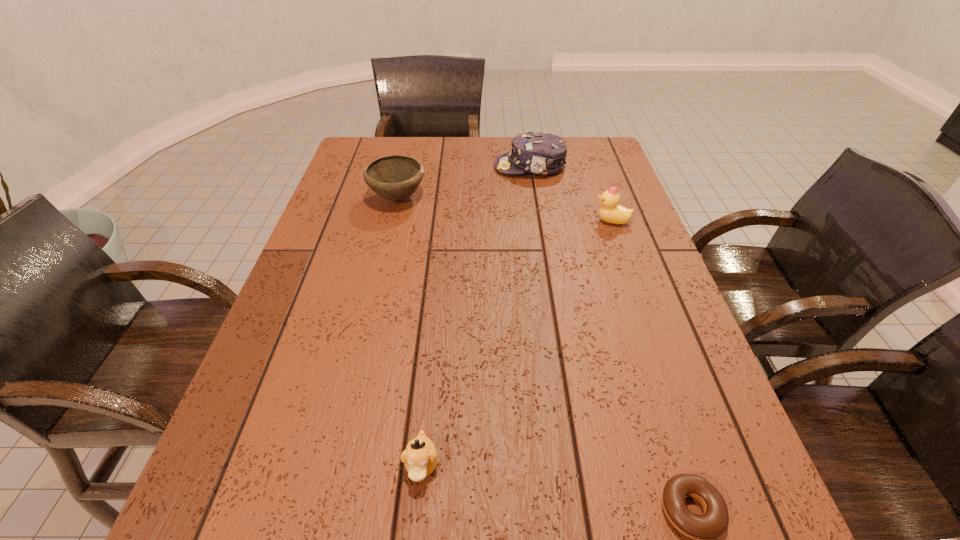
Identify the location of blank space located on the front-facing side of the taller duckling. The height and width of the screenshot is (540, 960). (564, 221).

You are a GUI agent. You are given a task and a screenshot of the screen. Output one action in this format:
    pyautogui.click(x=<x>, y=<y>)
    Task: Click on the vacant point located 0.380m on the front-facing side of the taller duckling
    Image resolution: width=960 pixels, height=540 pixels.
    Given the screenshot: What is the action you would take?
    pyautogui.click(x=455, y=221)

Find the location of a particular element. This screenshot has width=960, height=540. free location located 0.280m on the front-facing side of the taller duckling is located at coordinates (492, 221).

You are a GUI agent. You are given a task and a screenshot of the screen. Output one action in this format:
    pyautogui.click(x=<x>, y=<y>)
    Task: Click on the free space located on the front of the bowl
    
    Given the screenshot: What is the action you would take?
    pyautogui.click(x=388, y=240)

Identify the location of object that is at the far edge. This screenshot has height=540, width=960. (540, 153).

Locate an element on the screen. The image size is (960, 540). object that is at the left edge is located at coordinates (395, 178).

I want to click on headwear located at the right edge, so click(540, 153).

Where is `duckling that is at the right edge`? duckling that is at the right edge is located at coordinates (611, 212).

Where is `object situated at the far right corner`? object situated at the far right corner is located at coordinates (540, 153).

Image resolution: width=960 pixels, height=540 pixels. I want to click on vacant space at the far edge, so click(564, 170).